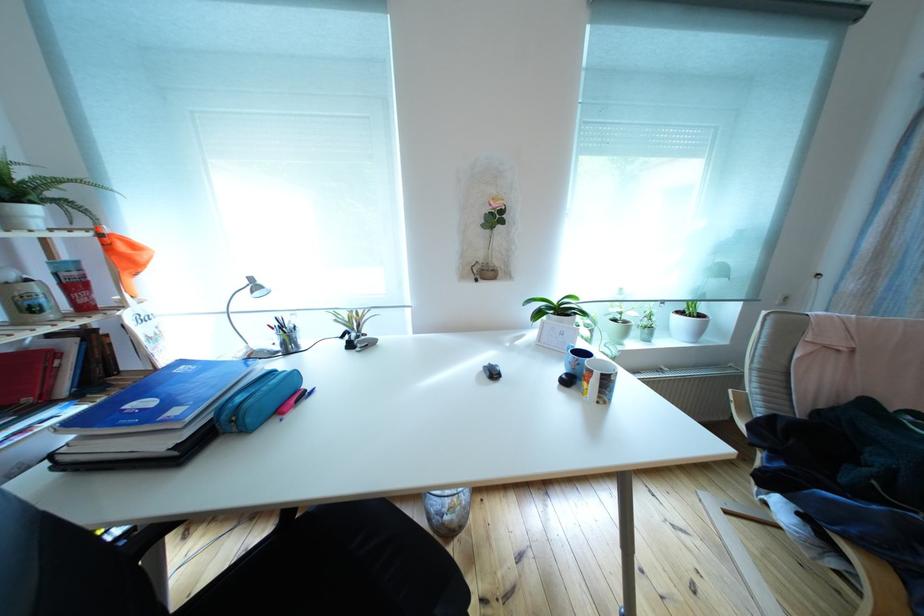
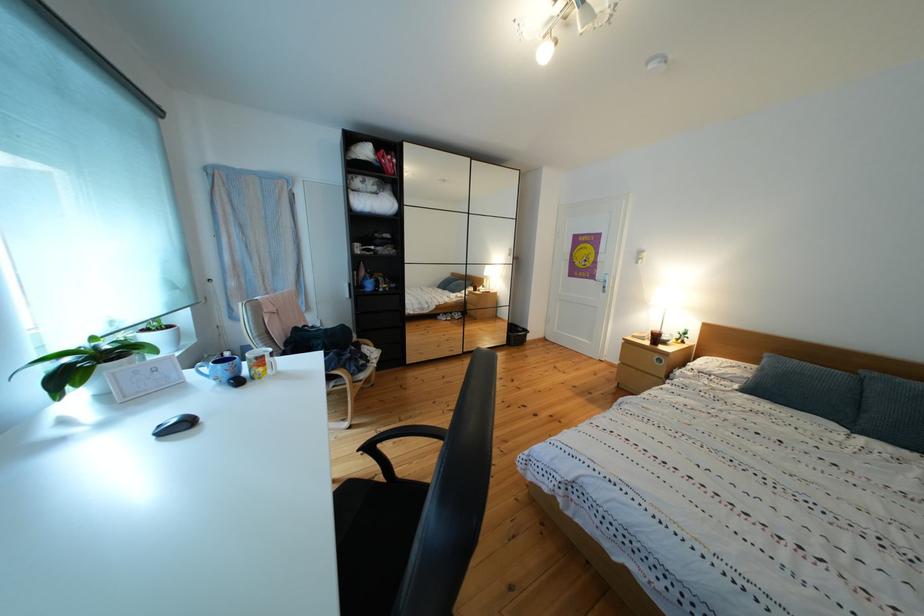
The images are taken continuously from a first-person perspective. In which direction is your viewpoint rotating?

The rotation direction of the camera is right-down.